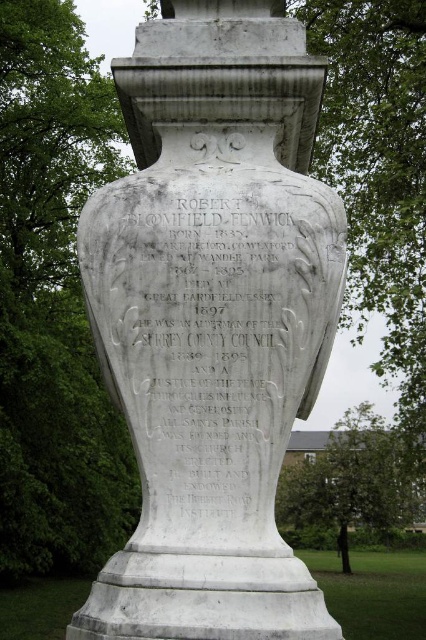
Question: Which point is closer to the camera?

Choices:
 (A) (160, 332)
 (B) (313, 465)

Answer: (A)

Question: From the image, what is the correct spatial relationship of white marble text at center in relation to green leafy tree at center?

Choices:
 (A) above
 (B) below

Answer: (A)

Question: Can you confirm if white marble vase at center is positioned to the left of white marble text at center?

Choices:
 (A) no
 (B) yes

Answer: (A)

Question: Is white marble vase at center to the left of green leafy tree at center from the viewer's perspective?

Choices:
 (A) yes
 (B) no

Answer: (A)

Question: Among these points, which one is nearest to the camera?

Choices:
 (A) (262, 406)
 (B) (351, 513)
 (C) (143, 252)

Answer: (A)

Question: Which of the following is the farthest from the observer?

Choices:
 (A) click(313, 179)
 (B) click(207, 369)
 (C) click(389, 428)

Answer: (C)